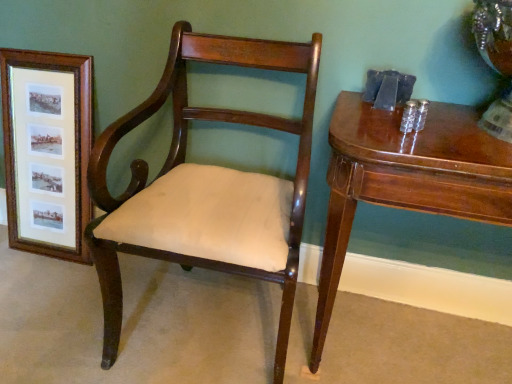
Question: From the image's perspective, relative to wooden framed prints at left, is glossy wood table at right above or below?

Choices:
 (A) below
 (B) above

Answer: (A)

Question: Is glossy wood table at right in front of or behind wooden framed prints at left in the image?

Choices:
 (A) behind
 (B) front

Answer: (B)

Question: Which of these objects is positioned farthest from the wooden framed prints at left?

Choices:
 (A) glossy wood table at right
 (B) mahogany wood chair at center

Answer: (A)

Question: Which object is the farthest from the wooden framed prints at left?

Choices:
 (A) glossy wood table at right
 (B) mahogany wood chair at center

Answer: (A)